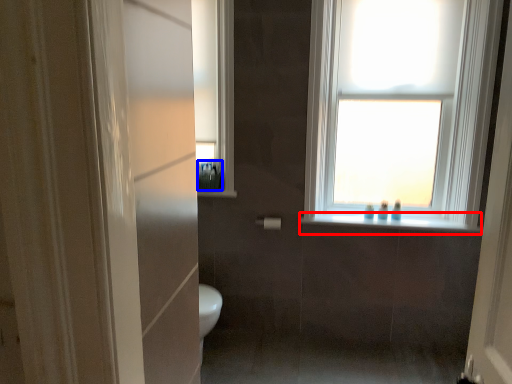
Question: Which of the following is the farthest to the observer, window sill (highlighted by a red box) or toiletry (highlighted by a blue box)?

Choices:
 (A) window sill
 (B) toiletry

Answer: (B)